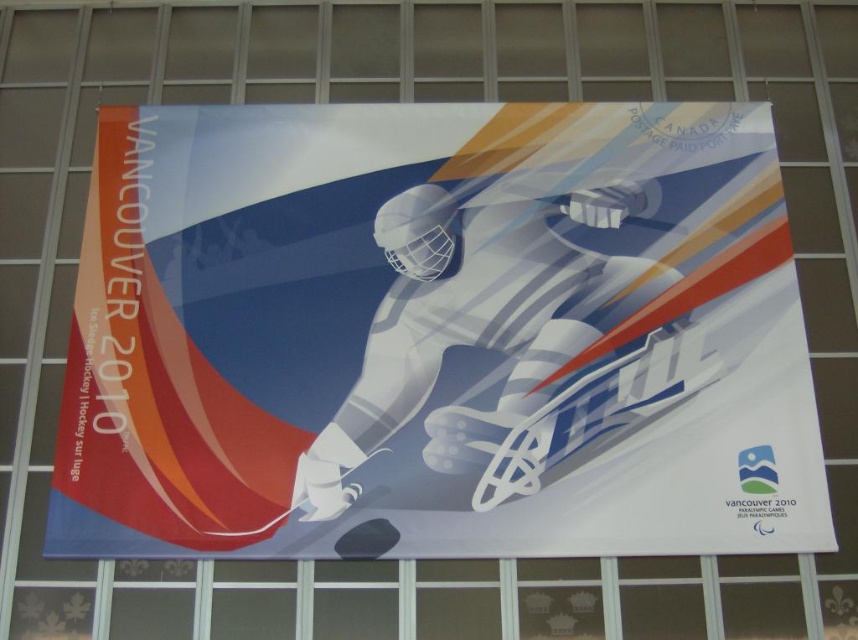
Can you confirm if matte white hockey player at center is positioned below white glossy astronaut at center?

No, matte white hockey player at center is not below white glossy astronaut at center.

This screenshot has width=858, height=640. Describe the element at coordinates (437, 336) in the screenshot. I see `matte white hockey player at center` at that location.

I want to click on matte white hockey player at center, so click(437, 336).